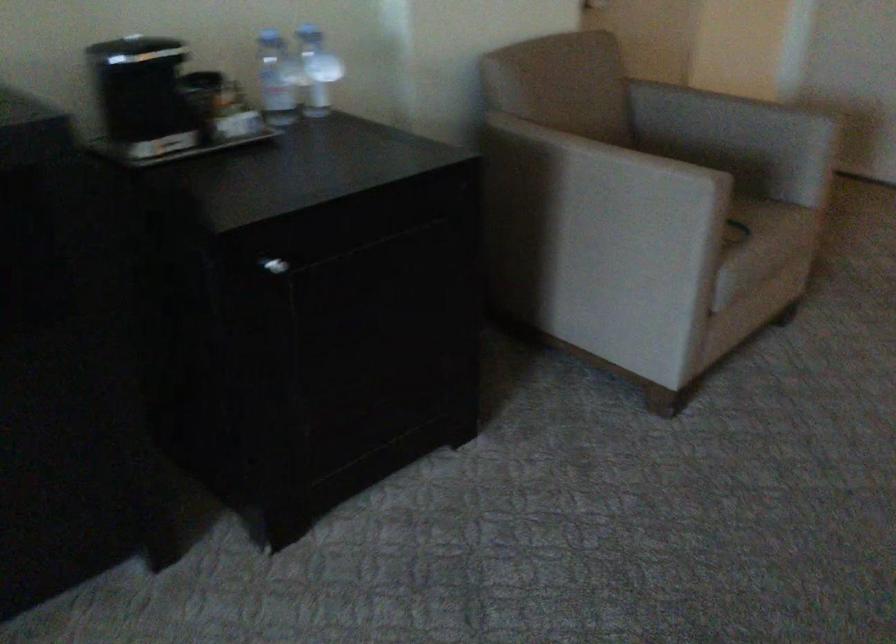
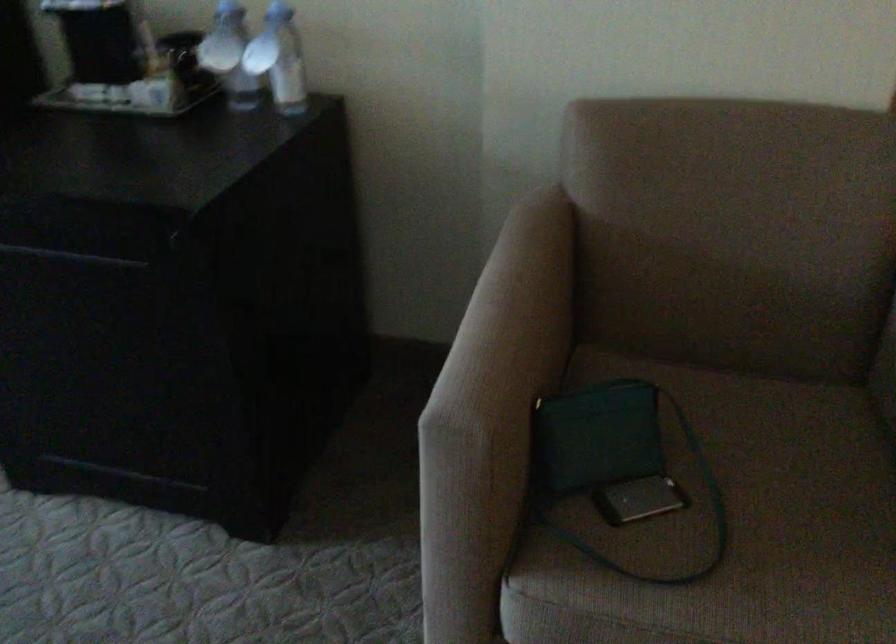
The point at [675,214] is marked in the first image. Where is the corresponding point in the second image?

(614, 464)